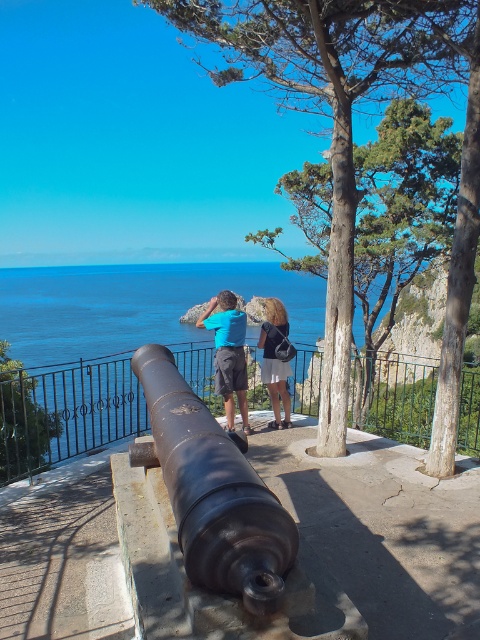
You are standing on the platform and want to place a small flag exactly halfway between the blue water at center and the rusty metal cannon at center. Which object will the flag be closer to?

The flag will be closer to the rusty metal cannon at center because the blue water at center is wider than the rusty metal cannon at center, so the halfway point would be nearer to the cannon.